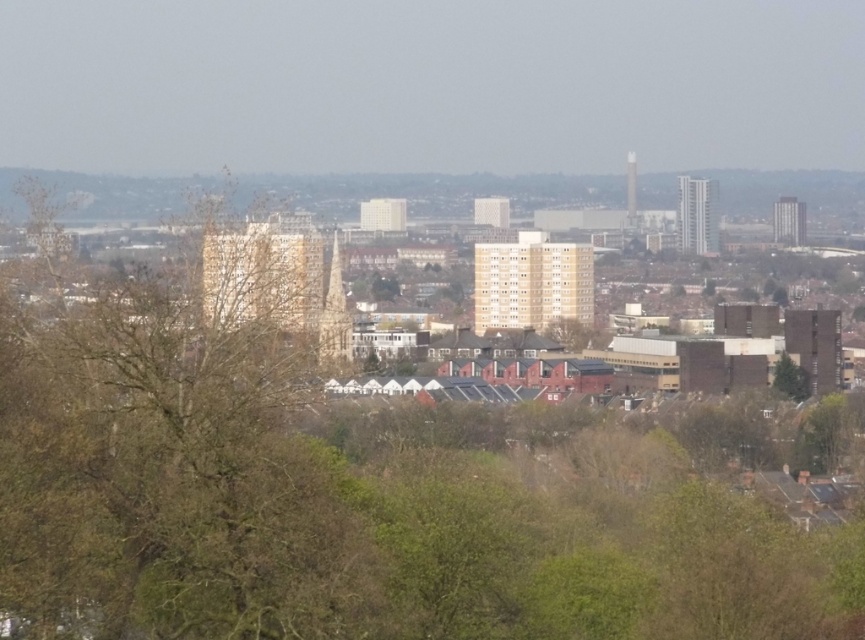
Can you confirm if green leafy tree at lower right is thinner than green leafy tree at center-right?

In fact, green leafy tree at lower right might be wider than green leafy tree at center-right.

Can you confirm if green leafy tree at lower right is smaller than green leafy tree at center-right?

Actually, green leafy tree at lower right might be larger than green leafy tree at center-right.

Does point (825, 456) lie behind point (790, 381)?

No, (825, 456) is closer to viewer.

Identify the location of green leafy tree at lower right. This screenshot has width=865, height=640. (827, 432).

Which of these two, green leafy tree at center or brown leafless tree at left, stands taller?

green leafy tree at center is taller.

Is green leafy tree at center positioned before brown leafless tree at left?

Yes, green leafy tree at center is in front of brown leafless tree at left.

Is point (188, 323) farther from camera compared to point (279, 518)?

Yes, point (188, 323) is behind point (279, 518).

Where is `green leafy tree at center`? green leafy tree at center is located at coordinates (367, 493).

Is the position of brown leafless tree at left more distant than that of green leafy tree at lower right?

No.

Does brown leafless tree at left appear on the right side of green leafy tree at lower right?

In fact, brown leafless tree at left is to the left of green leafy tree at lower right.

Is point (187, 627) positioned behind point (817, 445)?

No, it is in front of (817, 445).

Identify the location of brown leafless tree at left. The width and height of the screenshot is (865, 640). (168, 474).